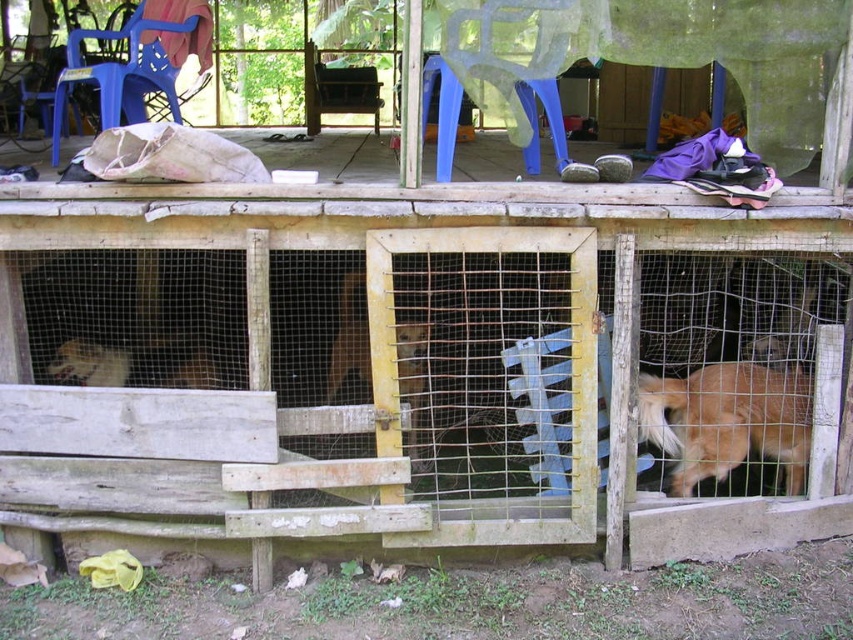
You are a dog owner visiting the wooden structure. You see the wooden wire cage at center and the golden fur dog at lower right. Which one is located higher up?

The wooden wire cage at center is above the golden fur dog at lower right, so it is higher up.

You are a dog owner who wants to feed your golden fur dog at lower right. The wooden wire cage at center has food. Can you reach the food from where your dog is without opening the cage?

The wooden wire cage at center is 20.24 inches from golden fur dog at lower right. Since the distance is too far, the dog cannot reach the food inside the cage without assistance.